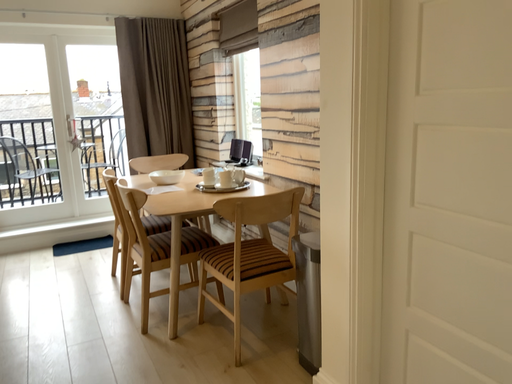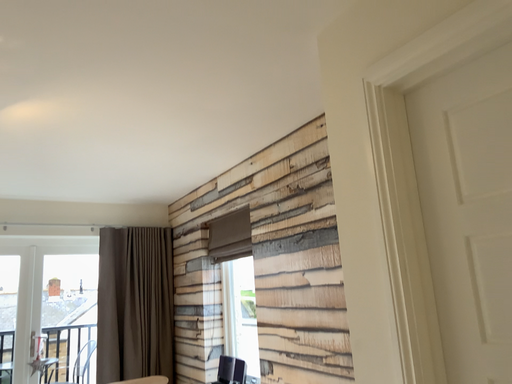
Question: How did the camera likely rotate when shooting the video?

Choices:
 (A) rotated upward
 (B) rotated downward

Answer: (A)